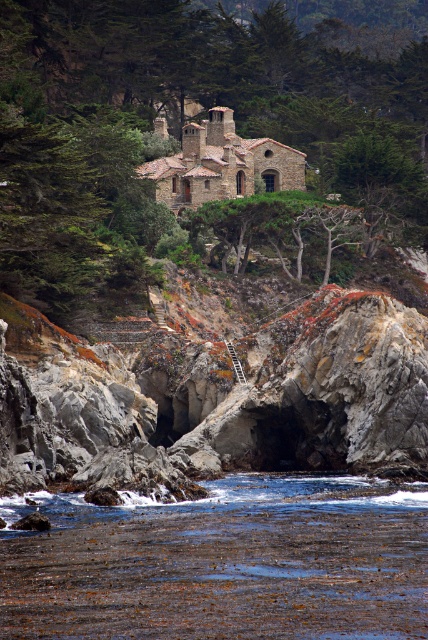
Can you confirm if green leafy tree at upper center is positioned to the right of brown seaweed at lower center?

Yes, green leafy tree at upper center is to the right of brown seaweed at lower center.

Is point (279, 84) positioned in front of point (97, 584)?

No, (279, 84) is further to viewer.

Is point (29, 241) positioned before point (374, 614)?

No, (29, 241) is behind (374, 614).

Locate an element on the screen. This screenshot has height=640, width=428. green leafy tree at upper center is located at coordinates (189, 132).